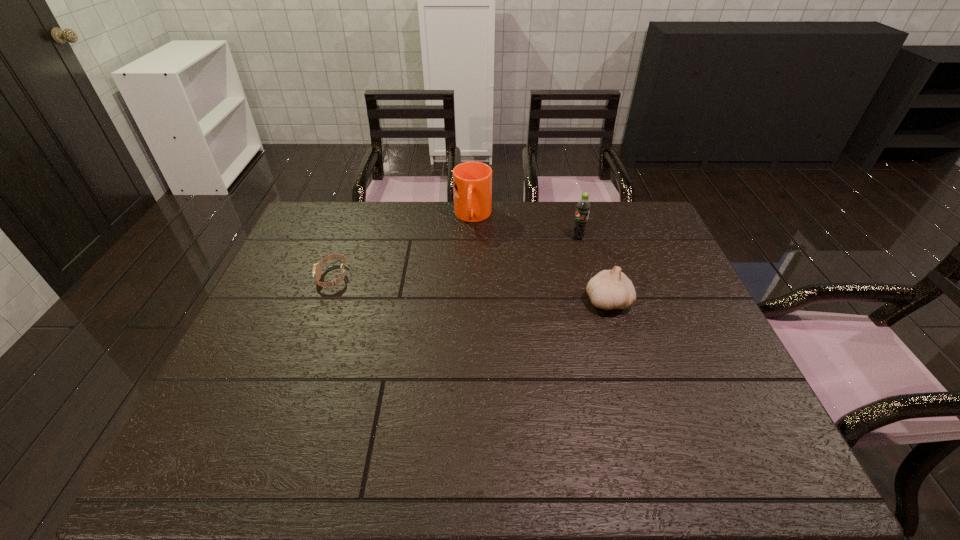
This screenshot has height=540, width=960. Find the location of `blank region between the second shortest object and the watch`. blank region between the second shortest object and the watch is located at coordinates point(470,289).

Find the location of a particular element. Image resolution: width=960 pixels, height=540 pixels. free space between the farthest object and the watch is located at coordinates (403, 247).

Identify the location of vacant point located between the leftmost object and the garlic. (470, 289).

Point out which object is positioned as the nearest to the garlic. Please provide its 2D coordinates. Your answer should be formatted as a tuple, i.e. [(x, y)], where the tuple contains the x and y coordinates of a point satisfying the conditions above.

[(583, 207)]

At what (x,y) coordinates should I click in order to perform the action: click on the third closest object relative to the third tallest object. Please return your answer as a coordinate pair (x, y). Looking at the image, I should click on (316, 271).

Find the location of a particular element. blank area in the image that satisfies the following two spatial constraints: 1. on the front side of the third nearest object; 2. on the left side of the third tallest object is located at coordinates tap(595, 301).